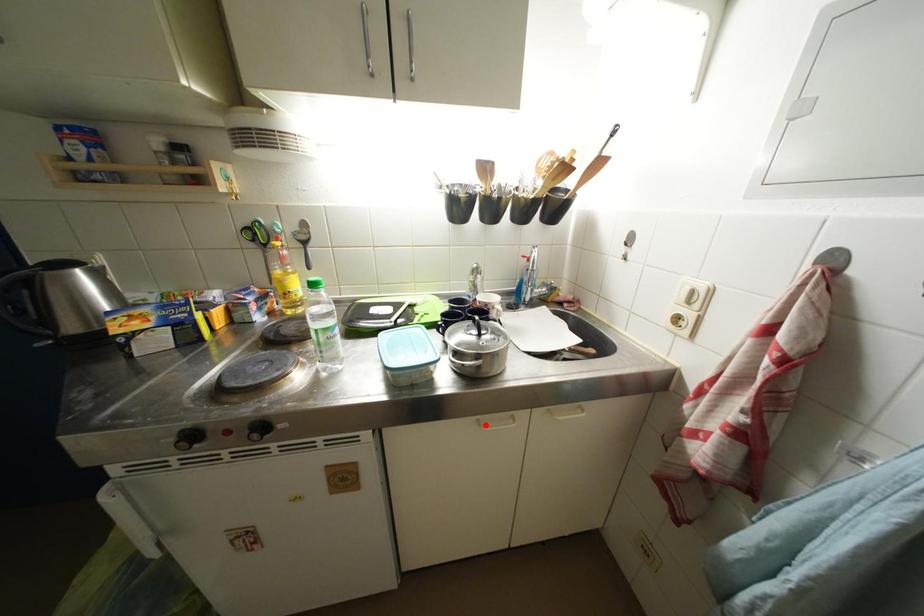
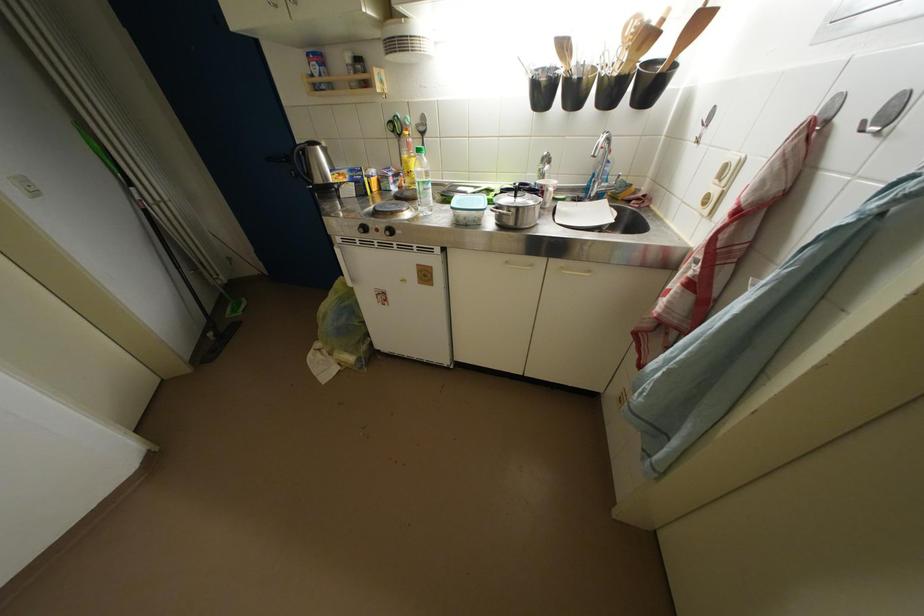
Question: I am providing you with two images of the same scene from different viewpoints. In image1, a red point is highlighted. Considering the same 3D point in image2, which of the following is correct?

Choices:
 (A) It is closer
 (B) It is farther

Answer: (A)